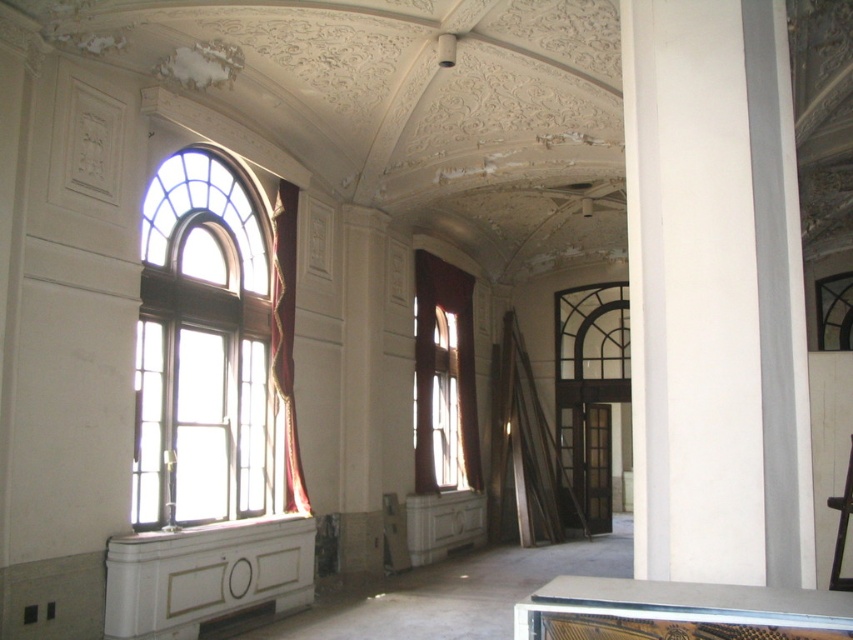
You are standing at the entrance of this grand space and want to walk straight towards the white smooth pillar at center and the matte red curtain at center. Which one will you reach first?

The white smooth pillar at center is 36.04 feet away from the matte red curtain at center. Since you are walking straight towards both, the white smooth pillar at center is closer to you and will be reached first.

You are an interior designer assessing the space. You need to determine if the clear glass window at left can be covered entirely by the matte red curtain at center. Based on their sizes, what is your conclusion?

The clear glass window at left has a smaller size compared to the matte red curtain at center, so the matte red curtain at center can fully cover the clear glass window at left.